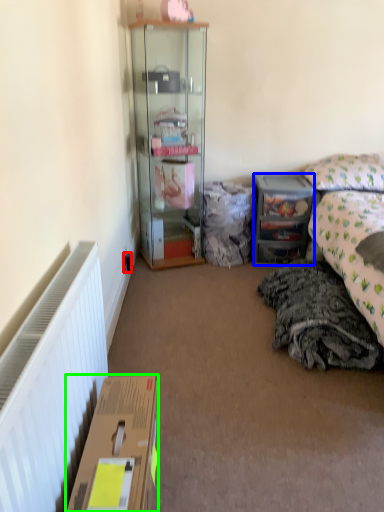
Question: Estimate the real-world distances between objects in this image. Which object is farther from power outlet (highlighted by a red box), desk (highlighted by a blue box) or box (highlighted by a green box)?

Choices:
 (A) desk
 (B) box

Answer: (B)